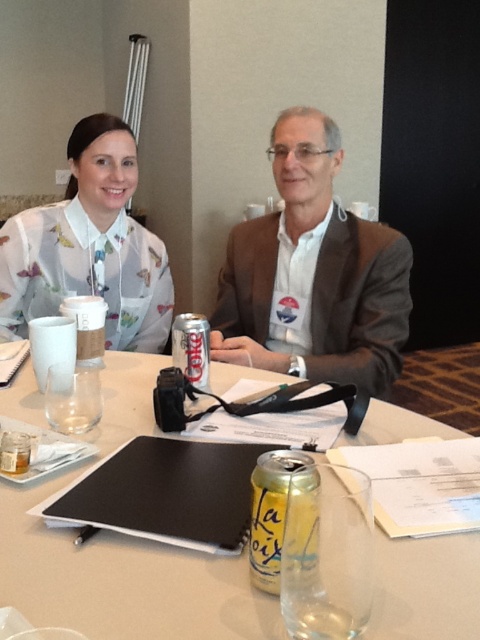
You are a photographer who needs to place a tripod between the clear glass water at center and the translucent floral blouse at upper left. Since the tripod requires a minimum of 20 cm of space, can you fit it there?

The clear glass water at center is shorter than the translucent floral blouse at upper left, but the description does not provide specific measurements for the distance between them. Therefore, it is unclear if there is enough space to fit the tripod.

You are a photographer trying to capture a candid shot of the two people at the table. You notice the matte brown blazer at center and the translucent floral blouse at upper left. Which clothing item is located to the right of the other?

The matte brown blazer at center is positioned on the right side of the translucent floral blouse at upper left.

You are a photographer standing 10 feet away from the table. You want to take a closeup photo of the matte white blouse at upper left without the translucent floral blouse at upper left appearing in the frame. Is this possible given their distance apart?

The matte white blouse at upper left and translucent floral blouse at upper left are only 7 inches apart. Since you are 10 feet away, the angle needed to capture just the matte white blouse at upper left would include the translucent floral blouse at upper left due to their close proximity. Therefore, it is not possible to take such a photo without the other blouse showing.